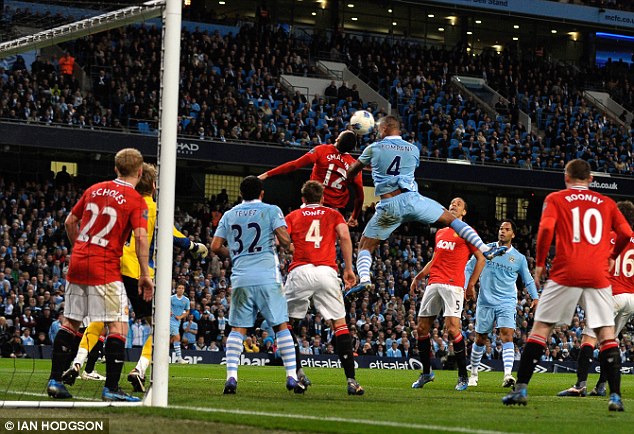
Identify the location of lights. Image resolution: width=634 pixels, height=434 pixels. (380, 14), (387, 11), (349, 11), (557, 33), (492, 29), (432, 25).